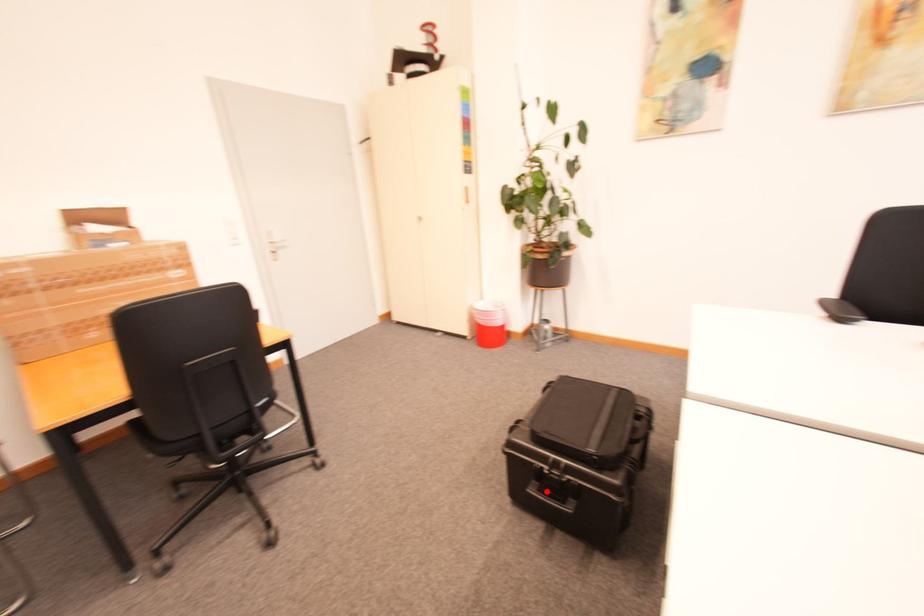
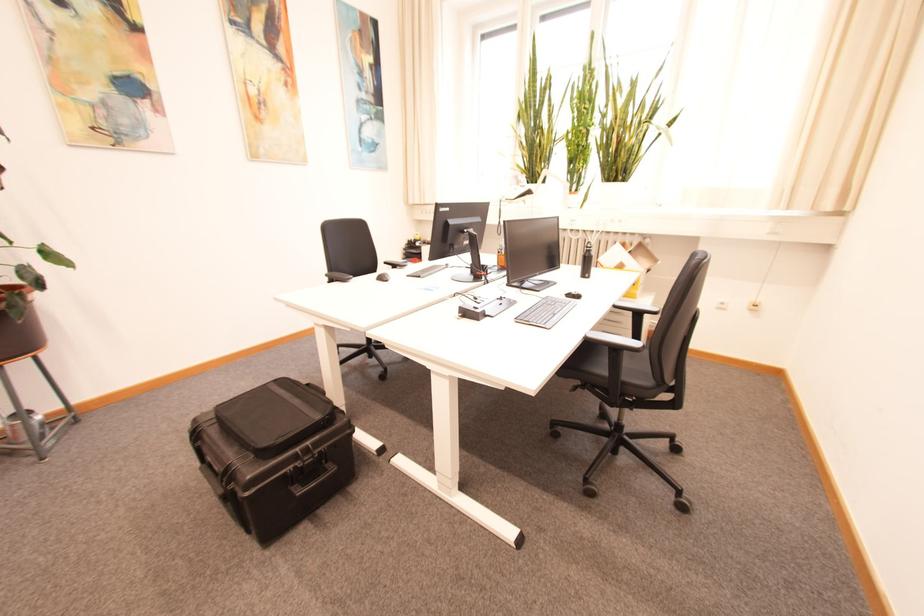
Question: I am providing you with two images of the same scene from different viewpoints. A red point is shown in image1. For the corresponding object point in image2, is it positioned nearer or farther from the camera?

Choices:
 (A) Nearer
 (B) Farther

Answer: (A)